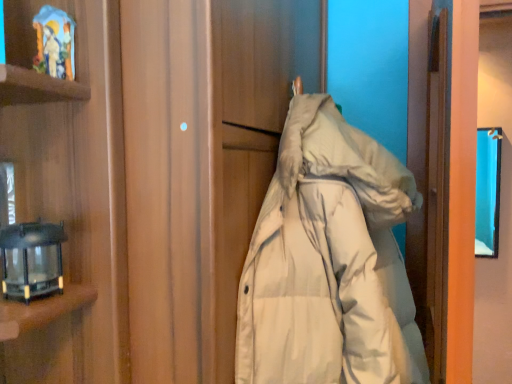
Question: Choose the correct answer: Is white down jacket at center inside black glass lantern at left or outside it?

Choices:
 (A) outside
 (B) inside

Answer: (A)

Question: In the image, is white down jacket at center positioned in front of or behind black glass lantern at left?

Choices:
 (A) front
 (B) behind

Answer: (A)

Question: In terms of size, does white down jacket at center appear bigger or smaller than black glass lantern at left?

Choices:
 (A) small
 (B) big

Answer: (B)

Question: Considering the positions of point (24, 263) and point (331, 334), is point (24, 263) closer or farther from the camera than point (331, 334)?

Choices:
 (A) closer
 (B) farther

Answer: (A)

Question: Is black glass lantern at left inside the boundaries of white down jacket at center, or outside?

Choices:
 (A) outside
 (B) inside

Answer: (A)

Question: From the image's perspective, is black glass lantern at left located above or below white down jacket at center?

Choices:
 (A) below
 (B) above

Answer: (B)

Question: In the image, is black glass lantern at left on the left side or the right side of white down jacket at center?

Choices:
 (A) left
 (B) right

Answer: (A)